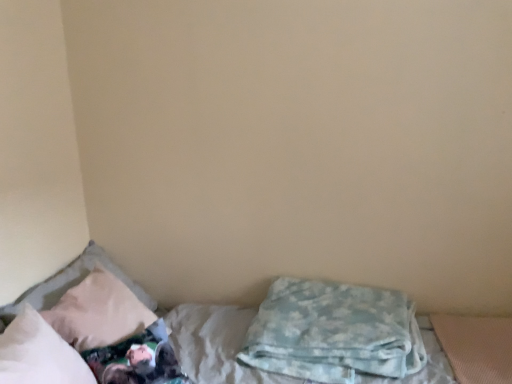
Question: Is blue soft blanket at lower right, acting as the 3th pillow starting from the left, bigger than white soft pillow at left, arranged as the first pillow when viewed from the left?

Choices:
 (A) no
 (B) yes

Answer: (B)

Question: Is blue soft blanket at lower right, acting as the 3th pillow starting from the left, in front of white soft pillow at left, which is the third pillow from right to left?

Choices:
 (A) no
 (B) yes

Answer: (A)

Question: Is blue soft blanket at lower right, placed as the 1th pillow when sorted from right to left, smaller than white soft pillow at left, which is the third pillow from right to left?

Choices:
 (A) yes
 (B) no

Answer: (B)

Question: Can you confirm if blue soft blanket at lower right, placed as the 1th pillow when sorted from right to left, is wider than white soft pillow at left, which is the third pillow from right to left?

Choices:
 (A) yes
 (B) no

Answer: (A)

Question: Is blue soft blanket at lower right, placed as the 1th pillow when sorted from right to left, turned away from white soft pillow at left, arranged as the first pillow when viewed from the left?

Choices:
 (A) yes
 (B) no

Answer: (B)

Question: Would you say white soft bed at lower left is to the left or to the right of blue soft blanket at lower right, placed as the 1th pillow when sorted from right to left, in the picture?

Choices:
 (A) right
 (B) left

Answer: (B)

Question: Is white soft bed at lower left spatially inside blue soft blanket at lower right, acting as the 3th pillow starting from the left, or outside of it?

Choices:
 (A) inside
 (B) outside

Answer: (B)

Question: From their relative heights in the image, would you say white soft bed at lower left is taller or shorter than blue soft blanket at lower right, placed as the 1th pillow when sorted from right to left?

Choices:
 (A) tall
 (B) short

Answer: (A)

Question: Is white soft bed at lower left wider or thinner than blue soft blanket at lower right, placed as the 1th pillow when sorted from right to left?

Choices:
 (A) wide
 (B) thin

Answer: (A)

Question: In terms of size, does blue soft blanket at lower right, placed as the 1th pillow when sorted from right to left, appear bigger or smaller than white soft pillow at left, which is the third pillow from right to left?

Choices:
 (A) small
 (B) big

Answer: (B)

Question: Is blue soft blanket at lower right, placed as the 1th pillow when sorted from right to left, taller or shorter than white soft pillow at left, arranged as the first pillow when viewed from the left?

Choices:
 (A) short
 (B) tall

Answer: (A)

Question: Is point [269, 309] closer or farther from the camera than point [24, 355]?

Choices:
 (A) farther
 (B) closer

Answer: (A)

Question: Considering the relative positions of blue soft blanket at lower right, placed as the 1th pillow when sorted from right to left, and white soft pillow at left, which is the third pillow from right to left, in the image provided, is blue soft blanket at lower right, placed as the 1th pillow when sorted from right to left, to the left or to the right of white soft pillow at left, which is the third pillow from right to left,?

Choices:
 (A) right
 (B) left

Answer: (A)

Question: Is beige fabric pillow at left, which appears as the second pillow when viewed from the right, bigger or smaller than white soft bed at lower left?

Choices:
 (A) small
 (B) big

Answer: (A)

Question: Choose the correct answer: Is beige fabric pillow at left, positioned as the second pillow in left-to-right order, inside white soft bed at lower left or outside it?

Choices:
 (A) outside
 (B) inside

Answer: (B)